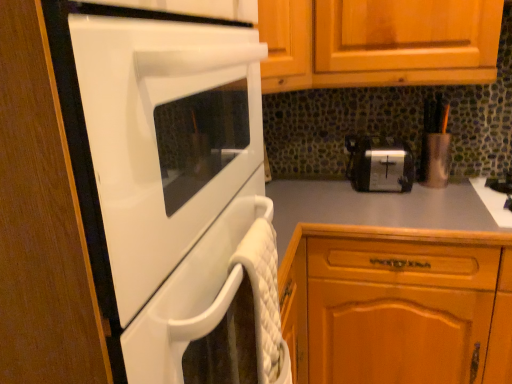
Question: From the image's perspective, is black matte gas stove at right below wooden cabinet at lower right?

Choices:
 (A) yes
 (B) no

Answer: (B)

Question: Considering the relative sizes of black matte gas stove at right and wooden cabinet at lower right in the image provided, is black matte gas stove at right bigger than wooden cabinet at lower right?

Choices:
 (A) no
 (B) yes

Answer: (A)

Question: Is black matte gas stove at right not within wooden cabinet at lower right?

Choices:
 (A) yes
 (B) no

Answer: (B)

Question: Is wooden cabinet at lower right located within black matte gas stove at right?

Choices:
 (A) yes
 (B) no

Answer: (B)

Question: Is black matte gas stove at right aimed at wooden cabinet at lower right?

Choices:
 (A) no
 (B) yes

Answer: (A)

Question: In the image, is black matte gas stove at right positioned in front of or behind wooden cabinet at lower right?

Choices:
 (A) behind
 (B) front

Answer: (A)

Question: Looking at the image, does black matte gas stove at right seem bigger or smaller compared to wooden cabinet at lower right?

Choices:
 (A) small
 (B) big

Answer: (A)

Question: From the image's perspective, relative to wooden cabinet at lower right, is black matte gas stove at right above or below?

Choices:
 (A) below
 (B) above

Answer: (B)

Question: Looking at their shapes, would you say black matte gas stove at right is wider or thinner than wooden cabinet at lower right?

Choices:
 (A) thin
 (B) wide

Answer: (A)

Question: Considering the relative positions of wooden cabinet at lower right and silver metallic toaster at center in the image provided, is wooden cabinet at lower right to the left or to the right of silver metallic toaster at center?

Choices:
 (A) left
 (B) right

Answer: (B)

Question: Considering the positions of wooden cabinet at lower right and silver metallic toaster at center in the image, is wooden cabinet at lower right bigger or smaller than silver metallic toaster at center?

Choices:
 (A) big
 (B) small

Answer: (A)

Question: Looking at their shapes, would you say wooden cabinet at lower right is wider or thinner than silver metallic toaster at center?

Choices:
 (A) thin
 (B) wide

Answer: (B)

Question: Considering their positions, is wooden cabinet at lower right located in front of or behind silver metallic toaster at center?

Choices:
 (A) front
 (B) behind

Answer: (A)

Question: Is white glossy oven at left in front of or behind black matte gas stove at right in the image?

Choices:
 (A) front
 (B) behind

Answer: (A)

Question: From the image's perspective, is white glossy oven at left positioned above or below black matte gas stove at right?

Choices:
 (A) above
 (B) below

Answer: (B)